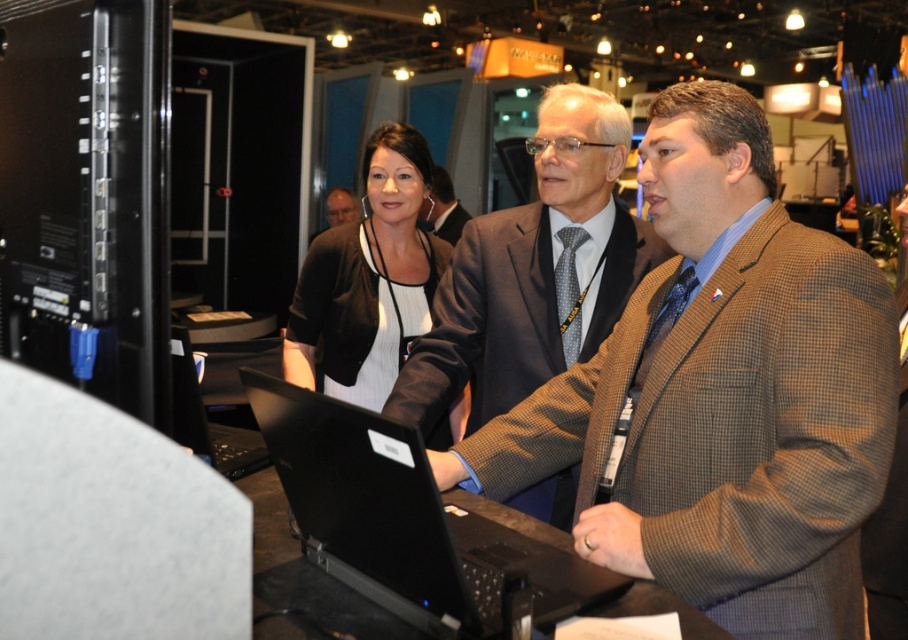
Can you confirm if brown checkered blazer at center is positioned to the right of black glossy laptop at center?

Yes, brown checkered blazer at center is to the right of black glossy laptop at center.

Which is behind, point (571, 515) or point (174, 419)?

The point (571, 515) is behind.

Is point (498, 396) positioned before point (176, 372)?

That is False.

This screenshot has height=640, width=908. Identify the location of brown checkered blazer at center. (534, 269).

Can you confirm if brown checkered blazer at center is thinner than dark gray wool suit at center?

No.

Is point (594, 285) closer to viewer compared to point (451, 236)?

Yes, it is in front of point (451, 236).

Where is `brown checkered blazer at center`? This screenshot has height=640, width=908. brown checkered blazer at center is located at coordinates (534, 269).

This screenshot has width=908, height=640. What do you see at coordinates (206, 419) in the screenshot? I see `black glossy laptop at center` at bounding box center [206, 419].

Which is above, black glossy laptop at center or brown wool suit at center?

brown wool suit at center is higher up.

Does point (235, 433) lie in front of point (442, 172)?

Yes, it is.

The height and width of the screenshot is (640, 908). What are the coordinates of `black glossy laptop at center` in the screenshot? It's located at (206, 419).